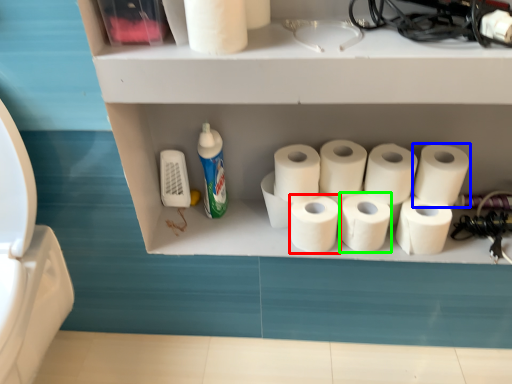
Question: Based on their relative distances, which object is nearer to toilet paper (highlighted by a red box)? Choose from toilet paper (highlighted by a blue box) and toilet paper (highlighted by a green box).

Choices:
 (A) toilet paper
 (B) toilet paper

Answer: (B)